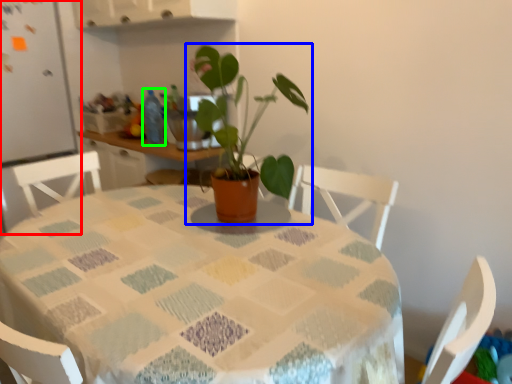
Question: Considering the real-world distances, which object is closest to fridge (highlighted by a red box)? houseplant (highlighted by a blue box) or bottle (highlighted by a green box).

Choices:
 (A) houseplant
 (B) bottle

Answer: (B)